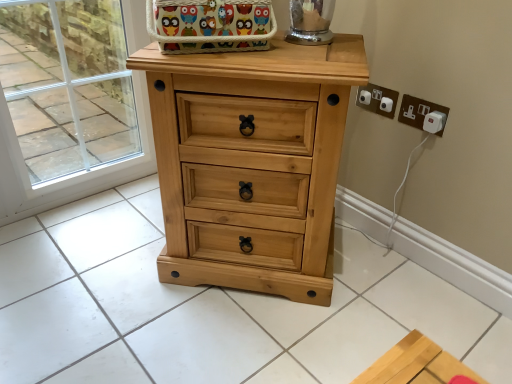
Question: Is transparent glass door at upper left wider or thinner than light wood chest of drawers at center?

Choices:
 (A) wide
 (B) thin

Answer: (B)

Question: Is transparent glass door at upper left bigger or smaller than light wood chest of drawers at center?

Choices:
 (A) big
 (B) small

Answer: (B)

Question: Which object is positioned closest to the multicolored fabric basket at upper center?

Choices:
 (A) transparent glass door at upper left
 (B) white plastic plug at upper right, which appears as the 1th electric outlet when viewed from the right
 (C) light wood chest of drawers at center
 (D) white plastic electrical outlet at upper right, placed as the second electric outlet when sorted from right to left

Answer: (C)

Question: Which is nearer to the multicolored fabric basket at upper center?

Choices:
 (A) white plastic electrical outlet at upper right, placed as the second electric outlet when sorted from right to left
 (B) transparent glass door at upper left
 (C) white plastic plug at upper right, positioned as the 2th electric outlet in left-to-right order
 (D) light wood chest of drawers at center

Answer: (D)